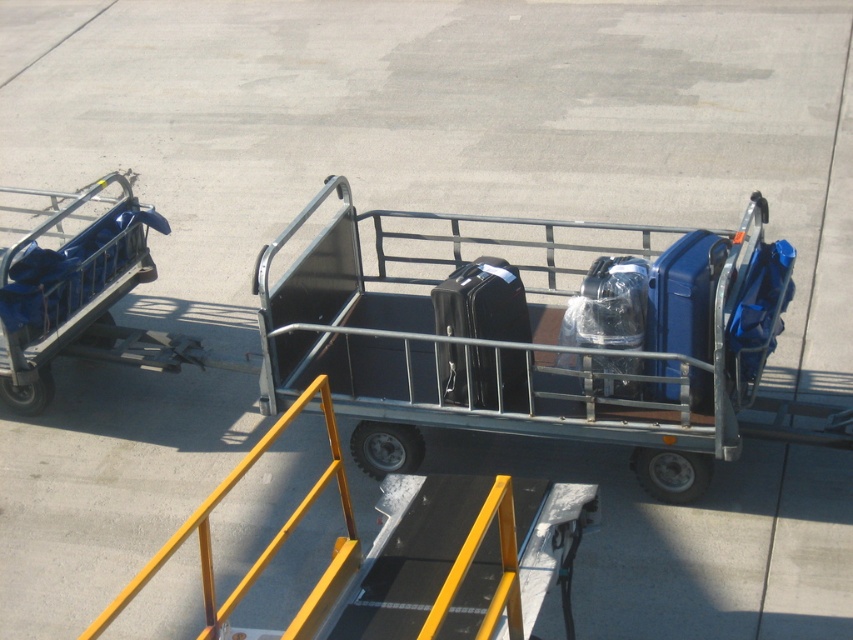
Between black hard suitcase at center and blue hardshell suitcase at center-right, which one is positioned higher?

Positioned higher is blue hardshell suitcase at center-right.

Describe the element at coordinates (482, 301) in the screenshot. I see `black hard suitcase at center` at that location.

Locate an element on the screen. The height and width of the screenshot is (640, 853). black hard suitcase at center is located at coordinates (482, 301).

Does metallic gray luggage cart at center appear under black hard suitcase at center?

Incorrect, metallic gray luggage cart at center is not positioned below black hard suitcase at center.

Image resolution: width=853 pixels, height=640 pixels. Identify the location of metallic gray luggage cart at center. (531, 337).

The width and height of the screenshot is (853, 640). In order to click on metallic gray luggage cart at center in this screenshot , I will do `click(531, 337)`.

Which of these two, metallic gray luggage cart at center or clear plastic suitcase at center, stands shorter?

clear plastic suitcase at center is shorter.

Is point (761, 248) positioned after point (616, 365)?

Yes.

At what (x,y) coordinates should I click in order to perform the action: click on metallic gray luggage cart at center. Please return your answer as a coordinate pair (x, y). Looking at the image, I should click on (531, 337).